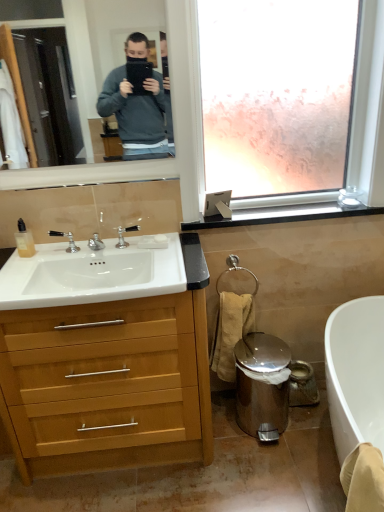
Question: Considering the relative positions of black plastic window sill at upper right and beige cotton towel at lower right in the image provided, is black plastic window sill at upper right to the left or to the right of beige cotton towel at lower right?

Choices:
 (A) right
 (B) left

Answer: (A)

Question: Considering the positions of black plastic window sill at upper right and beige cotton towel at lower right in the image, is black plastic window sill at upper right taller or shorter than beige cotton towel at lower right?

Choices:
 (A) short
 (B) tall

Answer: (A)

Question: Estimate the real-world distances between objects in this image. Which object is farther from the polished chrome faucet at sink left, the second faucet when ordered from right to left?

Choices:
 (A) beige cotton towel at lower right
 (B) polished chrome faucet at sink left, which is the second faucet in left-to-right order
 (C) black plastic window sill at upper right
 (D) translucent plastic bottle at sink left
 (E) polished stainless steel trash can at lower right

Answer: (E)

Question: Estimate the real-world distances between objects in this image. Which object is farther from the polished chrome faucet at sink left, which is counted as the first faucet, starting from the right?

Choices:
 (A) light wood/wooden cabinet at left
 (B) black plastic window sill at upper right
 (C) white matte soap at sink
 (D) polished chrome faucet at sink left, the 1th faucet from the left
 (E) beige cotton towel at lower right

Answer: (A)